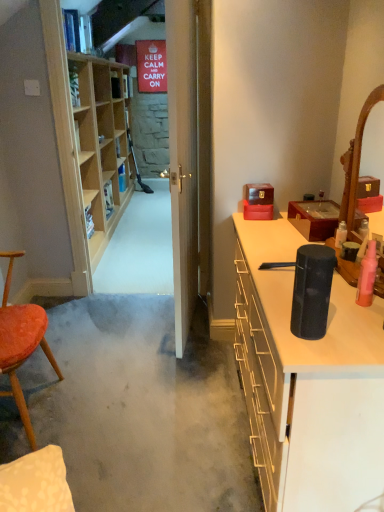
Where is `vacant space behind velvet orange chair at left`? The height and width of the screenshot is (512, 384). vacant space behind velvet orange chair at left is located at coordinates (76, 354).